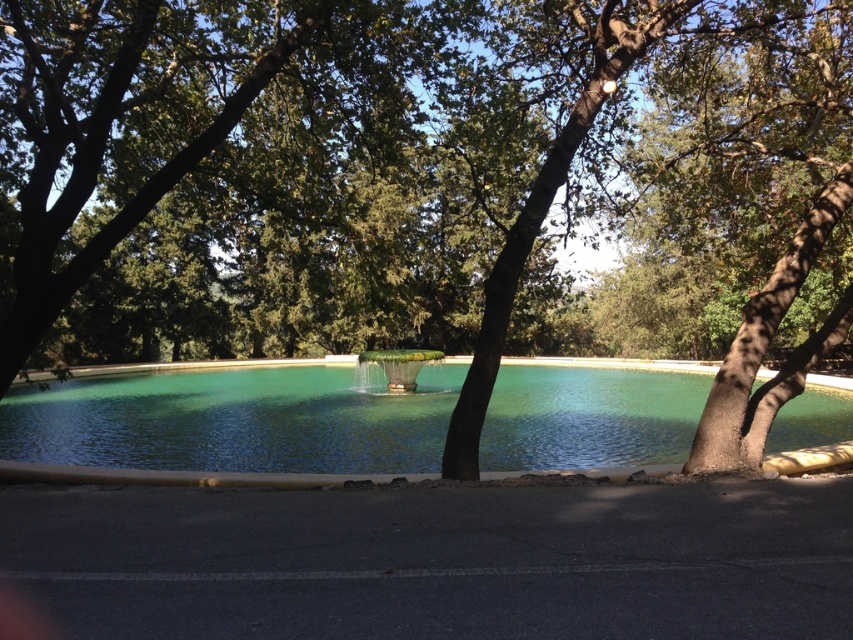
Question: Does green leafy tree at center have a smaller size compared to green marble fountain at center?

Choices:
 (A) yes
 (B) no

Answer: (B)

Question: Which of the following is the farthest from the observer?

Choices:
 (A) (387, 388)
 (B) (131, 392)

Answer: (B)

Question: Which point is closer to the camera?

Choices:
 (A) green glassy lake at center
 (B) green marble fountain at center
 (C) green leafy tree at center

Answer: (C)

Question: Is green glassy lake at center bigger than green marble fountain at center?

Choices:
 (A) yes
 (B) no

Answer: (A)

Question: Which of these objects is positioned farthest from the green marble fountain at center?

Choices:
 (A) green leafy tree at center
 (B) green glassy lake at center

Answer: (A)

Question: Does green leafy tree at center have a greater width compared to green glassy lake at center?

Choices:
 (A) yes
 (B) no

Answer: (A)